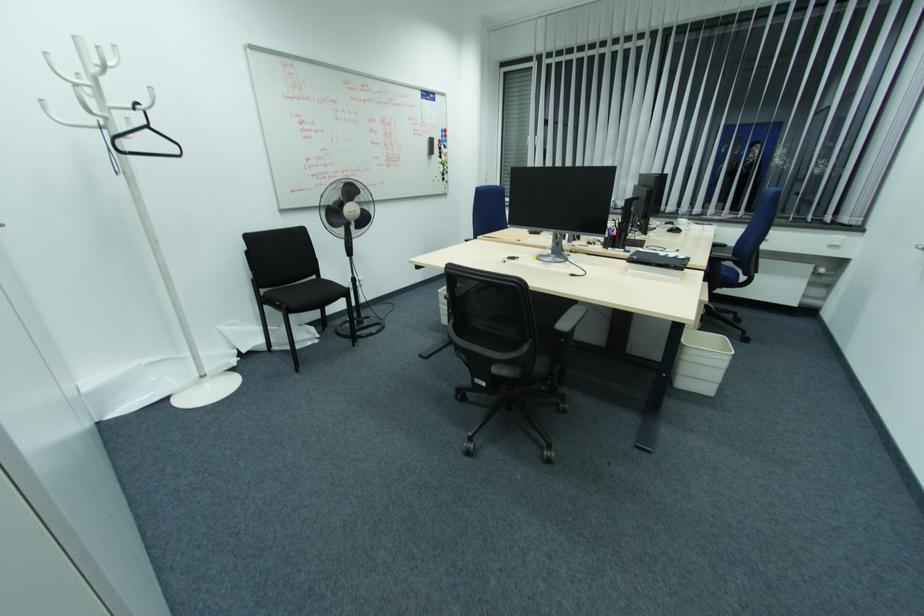
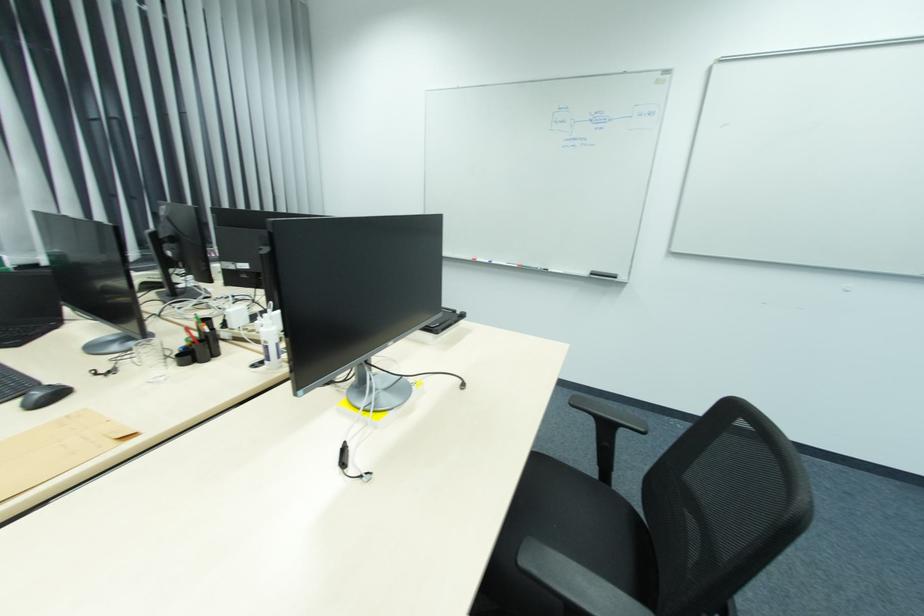
Find the pixel in the second image that matches point 519,241 in the first image.

(129, 436)